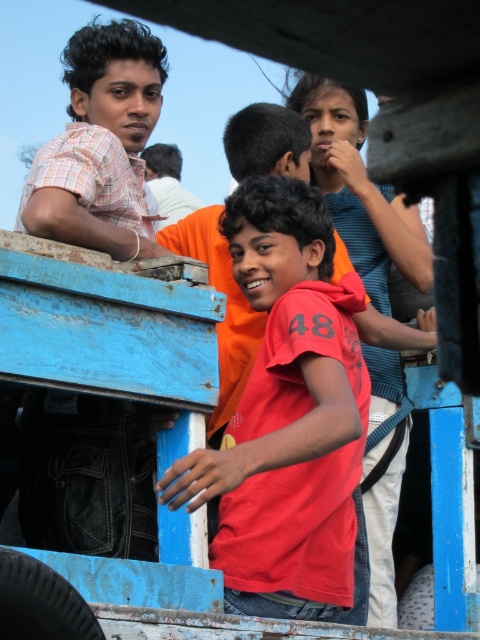
You are standing in front of the blue wooden structure and see the point labeled as point (100, 145). What object is located at that point?

The point labeled as point (100, 145) corresponds to the matte plaid shirt at left.